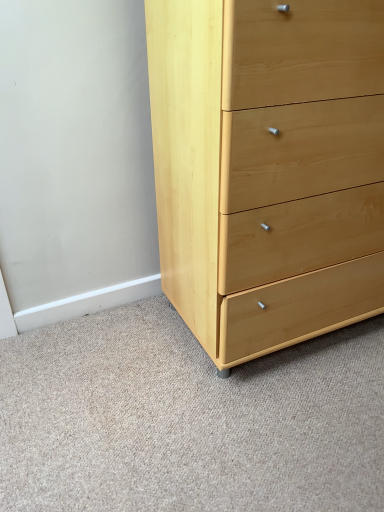
Question: Does natural wood chest of drawers at center touch light wood drawer at lower right?

Choices:
 (A) yes
 (B) no

Answer: (B)

Question: Is natural wood chest of drawers at center facing away from light wood drawer at lower right?

Choices:
 (A) no
 (B) yes

Answer: (A)

Question: Is natural wood chest of drawers at center aimed at light wood drawer at lower right?

Choices:
 (A) no
 (B) yes

Answer: (A)

Question: Is there a large distance between natural wood chest of drawers at center and light wood drawer at lower right?

Choices:
 (A) yes
 (B) no

Answer: (B)

Question: From a real-world perspective, is natural wood chest of drawers at center below light wood drawer at lower right?

Choices:
 (A) yes
 (B) no

Answer: (B)

Question: Does natural wood chest of drawers at center have a greater width compared to light wood drawer at lower right?

Choices:
 (A) yes
 (B) no

Answer: (B)

Question: Is light wood drawer at lower right located outside natural wood chest of drawers at center?

Choices:
 (A) yes
 (B) no

Answer: (A)

Question: From a real-world perspective, is light wood drawer at lower right positioned over natural wood chest of drawers at center based on gravity?

Choices:
 (A) yes
 (B) no

Answer: (B)

Question: Is light wood drawer at lower right wider than natural wood chest of drawers at center?

Choices:
 (A) no
 (B) yes

Answer: (B)

Question: Does light wood drawer at lower right have a smaller size compared to natural wood chest of drawers at center?

Choices:
 (A) no
 (B) yes

Answer: (B)

Question: Is light wood drawer at lower right next to natural wood chest of drawers at center?

Choices:
 (A) no
 (B) yes

Answer: (A)

Question: From the image's perspective, does light wood drawer at lower right appear higher than natural wood chest of drawers at center?

Choices:
 (A) no
 (B) yes

Answer: (A)

Question: From a real-world perspective, is natural wood chest of drawers at center positioned above or below light wood drawer at lower right?

Choices:
 (A) below
 (B) above

Answer: (B)